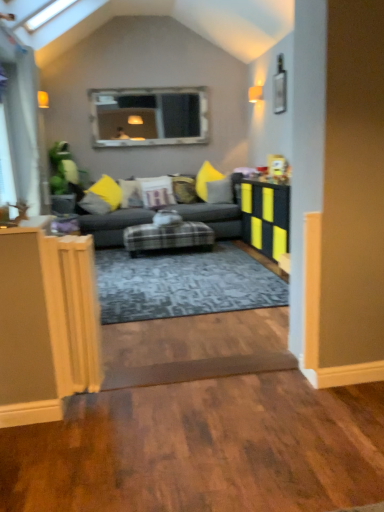
Question: Is point (107, 245) closer or farther from the camera than point (241, 185)?

Choices:
 (A) farther
 (B) closer

Answer: (B)

Question: From the image's perspective, is plush gray couch at center located above or below matte black table at right?

Choices:
 (A) above
 (B) below

Answer: (A)

Question: Considering the real-world distances, which object is closest to the yellow fabric pillow at left, which is the 5th pillow in right-to-left order?

Choices:
 (A) brown wood plank at lower center
 (B) velvet yellow pillow at center, the 4th pillow viewed from the left
 (C) velvet yellow pillow at center, the 4th pillow in the right-to-left sequence
 (D) transparent glass door at left
 (E) white fabric pillow at center, which is the 3th pillow in right-to-left order

Answer: (C)

Question: Estimate the real-world distances between objects in this image. Which object is closer to the brown wood plank at lower center?

Choices:
 (A) white fabric pillow at center, which is the 3th pillow in right-to-left order
 (B) velvet yellow pillow at center, positioned as the second pillow in right-to-left order
 (C) velvet yellow pillow at center, arranged as the second pillow when viewed from the left
 (D) transparent glass door at left
 (E) plush gray couch at center

Answer: (E)